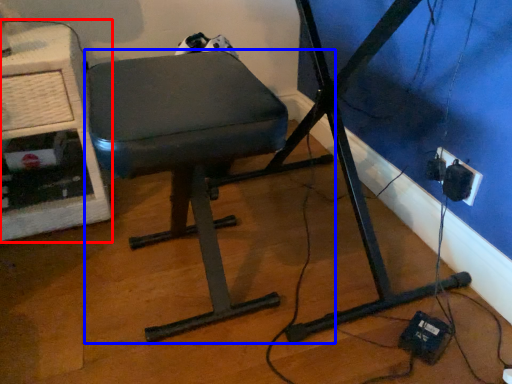
Question: Which object appears closest to the camera in this image, computer desk (highlighted by a red box) or furniture (highlighted by a blue box)?

Choices:
 (A) computer desk
 (B) furniture

Answer: (B)